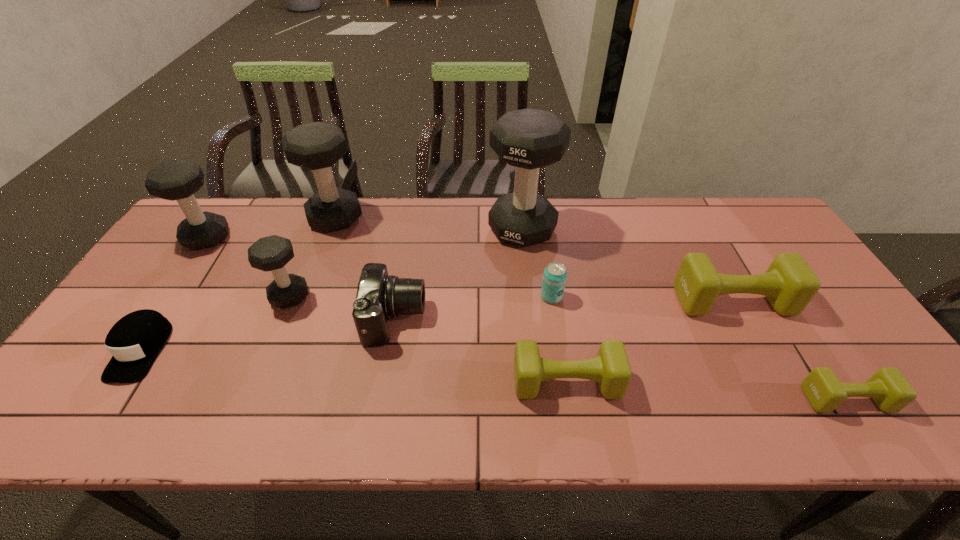
What are the coordinates of `free space located 0.140m on the lens of the sixth object from right to left` in the screenshot? It's located at (478, 319).

Find the location of `free point located 0.160m on the left of the fifth tallest dumbbell`. free point located 0.160m on the left of the fifth tallest dumbbell is located at coordinates (618, 301).

At what (x,y) coordinates should I click in order to perform the action: click on vacant space located on the front of the beer can. Please return your answer as a coordinate pair (x, y). The image size is (960, 540). Looking at the image, I should click on (556, 326).

This screenshot has width=960, height=540. I want to click on vacant area situated 0.250m on the right of the sixth tallest dumbbell, so click(x=727, y=382).

Image resolution: width=960 pixels, height=540 pixels. What are the coordinates of `vacant space located on the front-facing side of the cap` in the screenshot? It's located at (91, 426).

You are a GUI agent. You are given a task and a screenshot of the screen. Output one action in this format:
    pyautogui.click(x=<x>, y=<y>)
    Task: Click on the free space located on the left of the shortest dumbbell
    The height and width of the screenshot is (540, 960).
    Given the screenshot: What is the action you would take?
    pyautogui.click(x=738, y=399)

The width and height of the screenshot is (960, 540). In order to click on dumbbell that is at the left edge in this screenshot , I will do `click(178, 180)`.

In order to click on cap at the left edge in this screenshot , I will do `click(135, 340)`.

Identify the location of object that is at the far left corner. The height and width of the screenshot is (540, 960). (178, 180).

This screenshot has width=960, height=540. I want to click on object that is at the near right corner, so click(888, 388).